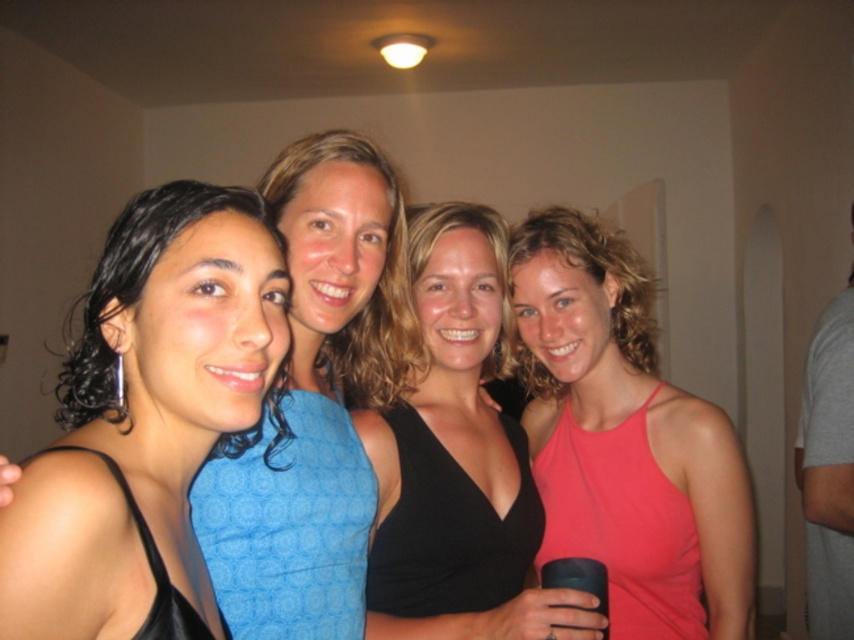
You are standing in a room with four women. You notice two points marked on the wall. The first point is at coordinates point [162,250] and the second is at point [832,410]. Which point is closer to you?

The point at coordinates point [162,250] is closer to you than the point at point [832,410].

You are standing in the room and want to hand a black matte tank top to the woman wearing it. Based on their positions in the image, which woman should you approach to give the black matte tank top at left?

The black matte tank top at left is worn by the first woman from the left, so you should approach the first woman from the left to give her the black matte tank top at left.